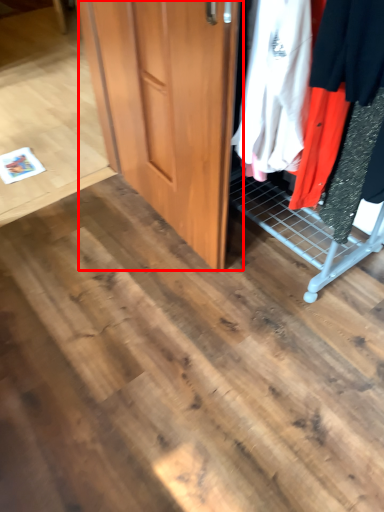
Question: Observing the image, what is the correct spatial positioning of door (annotated by the red box) in reference to closet?

Choices:
 (A) left
 (B) right

Answer: (A)